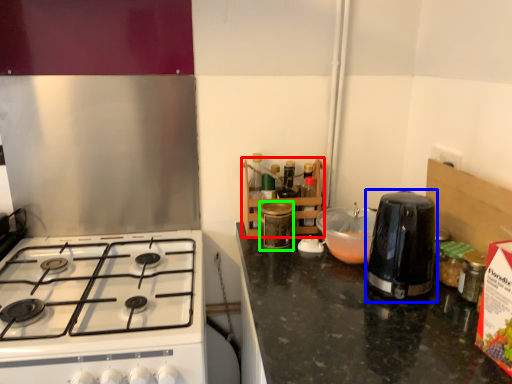
Question: Which is farther away from shelf (highlighted by a red box)? kitchen appliance (highlighted by a blue box) or kitchen appliance (highlighted by a green box)?

Choices:
 (A) kitchen appliance
 (B) kitchen appliance

Answer: (A)